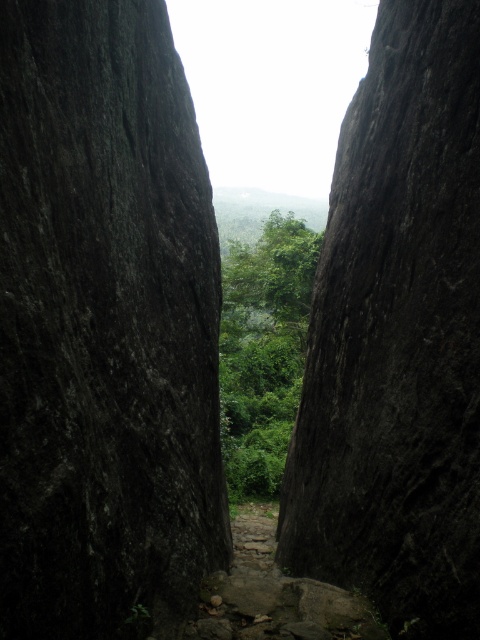
Based on the scene description, where is the dark gray rough rock face at center located in the image?

The dark gray rough rock face at center is located at the point with coordinates [105,326] in the image.

You are standing at the entrance of the narrow passage between the two towering rock formations. You notice two points marked in the scene. Which point, point (7, 467) or point (228, 369), is closer to you?

Point (7, 467) is closer to the camera than point (228, 369), so the point (7, 467) is closer to you.

You are standing at the entrance of the narrow passage between the two towering rock formations. You notice a point marked at coordinates (105, 326). What does this point indicate?

The point at (105, 326) marks the location of the dark gray rough rock face at center.